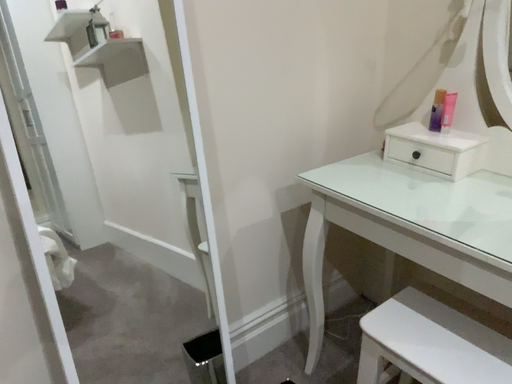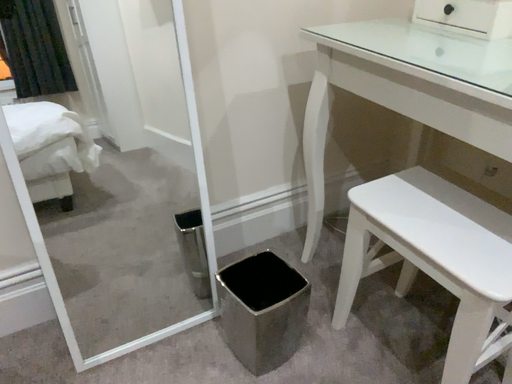
Question: How did the camera likely rotate when shooting the video?

Choices:
 (A) rotated left
 (B) rotated right

Answer: (A)